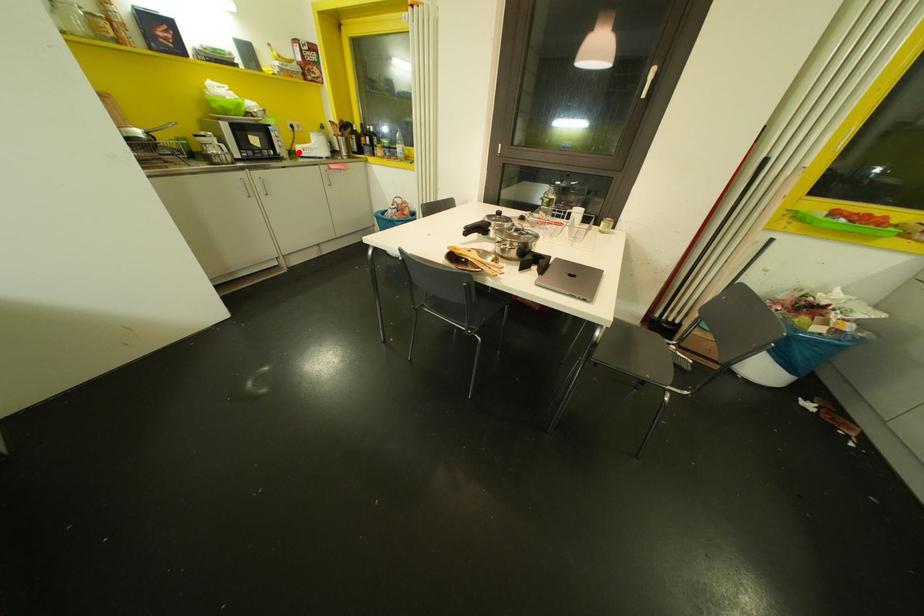
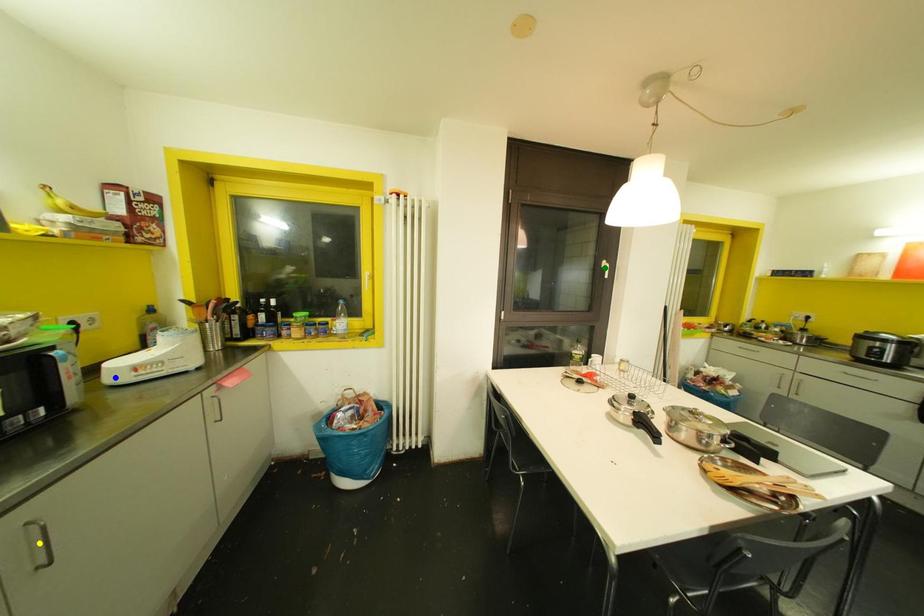
Question: I am providing you with two images of the same scene from different viewpoints. A red point is marked on the first image. You are given multiple points on the second image. Can you choose the point in image 2 that corresponds to the point in image 1?

Choices:
 (A) yellow point
 (B) blue point
 (C) green point

Answer: (B)